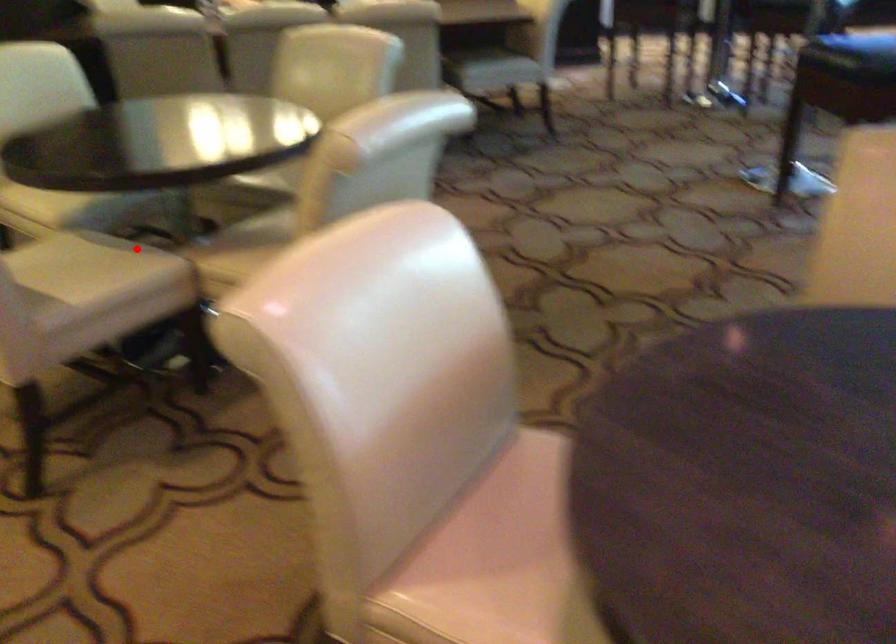
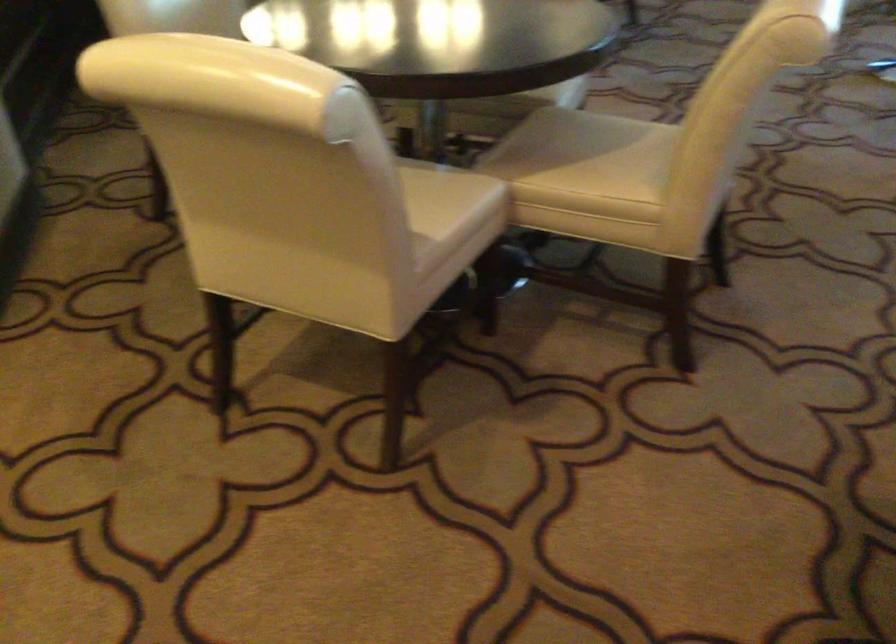
Question: I am providing you with two images of the same scene from different viewpoints. Given a red point in image1, look at the same physical point in image2. Is it:

Choices:
 (A) Closer to the viewpoint
 (B) Farther from the viewpoint

Answer: (A)